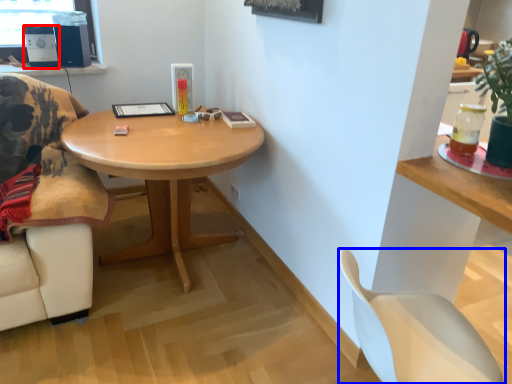
Question: Among these objects, which one is nearest to the camera, speaker (highlighted by a red box) or chair (highlighted by a blue box)?

Choices:
 (A) speaker
 (B) chair

Answer: (B)